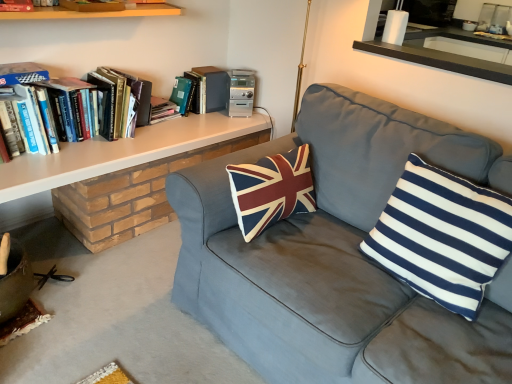
Question: From the image's perspective, is white/blue striped pillow at right on top of hardcover books at left, the third book when ordered from back to front?

Choices:
 (A) yes
 (B) no

Answer: (B)

Question: Is white/blue striped pillow at right outside hardcover books at left, the third book when ordered from back to front?

Choices:
 (A) yes
 (B) no

Answer: (A)

Question: Is white/blue striped pillow at right far away from hardcover books at left, the third book when ordered from back to front?

Choices:
 (A) yes
 (B) no

Answer: (A)

Question: Is white/blue striped pillow at right taller than hardcover books at left, the third book when ordered from back to front?

Choices:
 (A) no
 (B) yes

Answer: (B)

Question: From a real-world perspective, is white/blue striped pillow at right beneath hardcover books at left, the third book when ordered from back to front?

Choices:
 (A) yes
 (B) no

Answer: (A)

Question: In the image, is white/blue striped pillow at right positioned in front of or behind hardcover book at upper left, which ranks as the second book in back-to-front order?

Choices:
 (A) behind
 (B) front

Answer: (B)

Question: Looking at their shapes, would you say white/blue striped pillow at right is wider or thinner than hardcover book at upper left, which ranks as the second book in back-to-front order?

Choices:
 (A) wide
 (B) thin

Answer: (A)

Question: Is white/blue striped pillow at right taller or shorter than hardcover book at upper left, the third book viewed from the front?

Choices:
 (A) tall
 (B) short

Answer: (A)

Question: From the image's perspective, is white/blue striped pillow at right located above or below hardcover book at upper left, the third book viewed from the front?

Choices:
 (A) above
 (B) below

Answer: (B)

Question: Considering the positions of hardcover book at upper left, which ranks as the second book in back-to-front order, and white/blue striped pillow at right in the image, is hardcover book at upper left, which ranks as the second book in back-to-front order, wider or thinner than white/blue striped pillow at right?

Choices:
 (A) thin
 (B) wide

Answer: (A)

Question: Considering the positions of point (160, 117) and point (416, 175), is point (160, 117) closer or farther from the camera than point (416, 175)?

Choices:
 (A) farther
 (B) closer

Answer: (A)

Question: Based on their positions, is hardcover book at upper left, which ranks as the second book in back-to-front order, located to the left or right of white/blue striped pillow at right?

Choices:
 (A) left
 (B) right

Answer: (A)

Question: Is hardcover book at upper left, which ranks as the second book in back-to-front order, taller or shorter than white/blue striped pillow at right?

Choices:
 (A) short
 (B) tall

Answer: (A)

Question: Considering the positions of white/blue striped pillow at right and hardcover book at upper left, which ranks as the first book in front-to-back order, in the image, is white/blue striped pillow at right taller or shorter than hardcover book at upper left, which ranks as the first book in front-to-back order,?

Choices:
 (A) tall
 (B) short

Answer: (A)

Question: Is point (397, 218) positioned closer to the camera than point (10, 11)?

Choices:
 (A) farther
 (B) closer

Answer: (B)